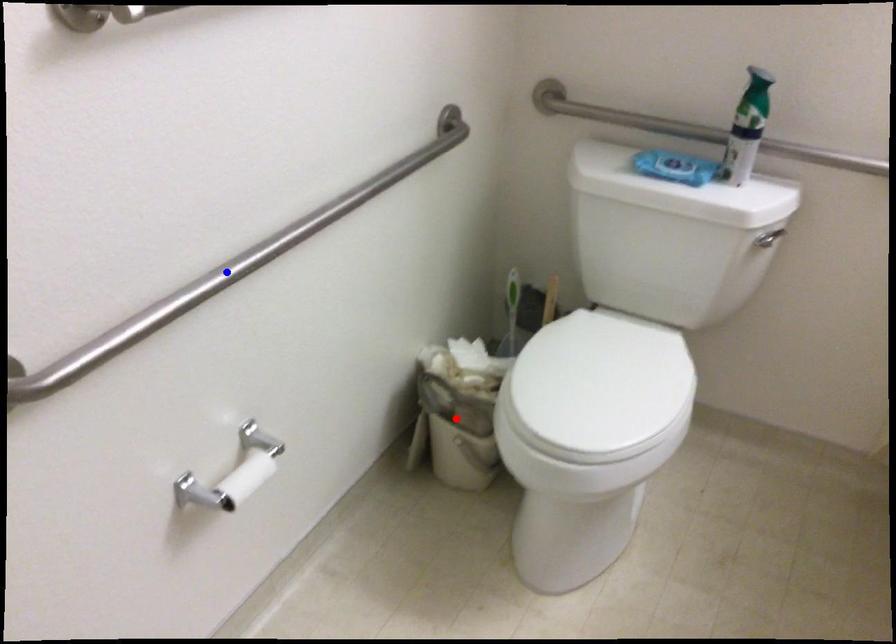
Question: Two points are marked on the image. Which point is closer to the camera?

Choices:
 (A) Blue point is closer.
 (B) Red point is closer.

Answer: (A)